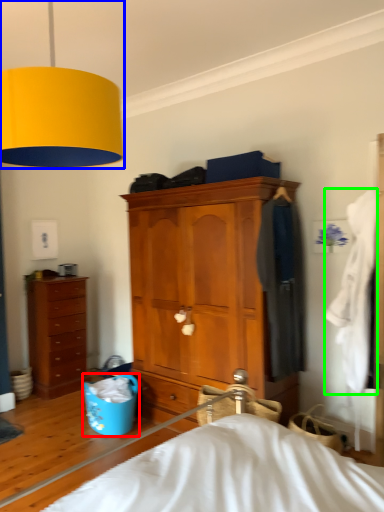
Question: Based on their relative distances, which object is farther from laundry basket (highlighted by a red box)? Choose from lamp (highlighted by a blue box) and clothing (highlighted by a green box).

Choices:
 (A) lamp
 (B) clothing

Answer: (A)